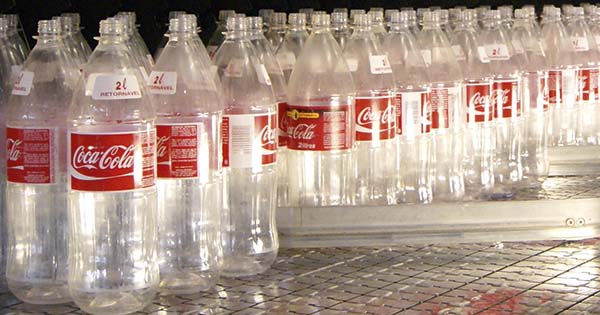
At what (x,y) coordinates should I click in order to perform the action: click on first fully visible bottle on the left. Please return your answer as a coordinate pair (x, y). Looking at the image, I should click on (39, 74).